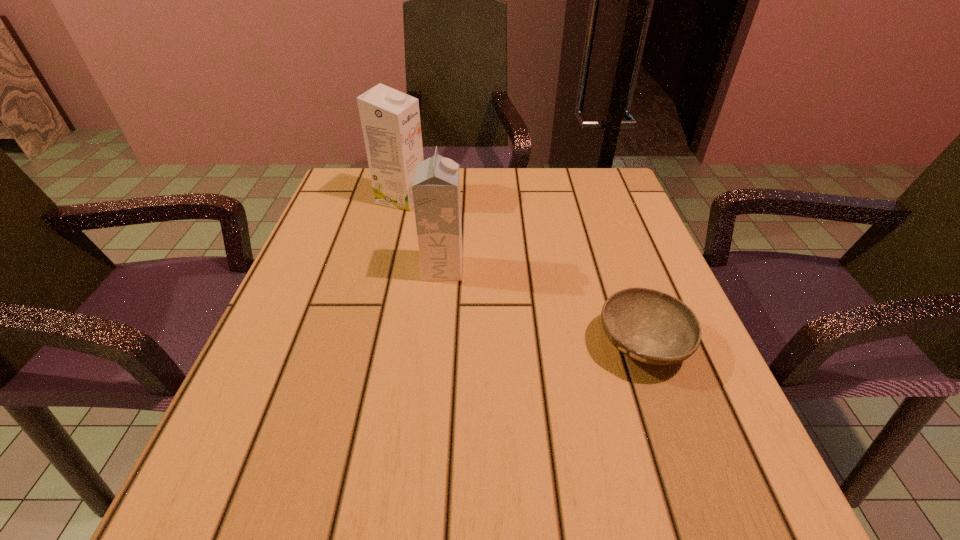
Locate an element on the screen. The height and width of the screenshot is (540, 960). the leftmost object is located at coordinates (390, 119).

Identify the location of the farthest object. (390, 119).

Where is `the second nearest object`? The width and height of the screenshot is (960, 540). the second nearest object is located at coordinates (436, 184).

The image size is (960, 540). In order to click on the right carton in this screenshot , I will do `click(436, 184)`.

Image resolution: width=960 pixels, height=540 pixels. I want to click on bowl, so click(x=649, y=326).

Find the location of a particular element. The width and height of the screenshot is (960, 540). the shortest object is located at coordinates (649, 326).

Locate an element on the screen. The height and width of the screenshot is (540, 960). vacant space located on the back of the left carton is located at coordinates (407, 176).

Image resolution: width=960 pixels, height=540 pixels. I want to click on free location located on the front label of the nearer carton, so click(487, 268).

Where is `vacant area located 0.350m on the back of the bowl`? The image size is (960, 540). vacant area located 0.350m on the back of the bowl is located at coordinates (594, 205).

The height and width of the screenshot is (540, 960). Find the location of `object located at the far edge`. object located at the far edge is located at coordinates (390, 119).